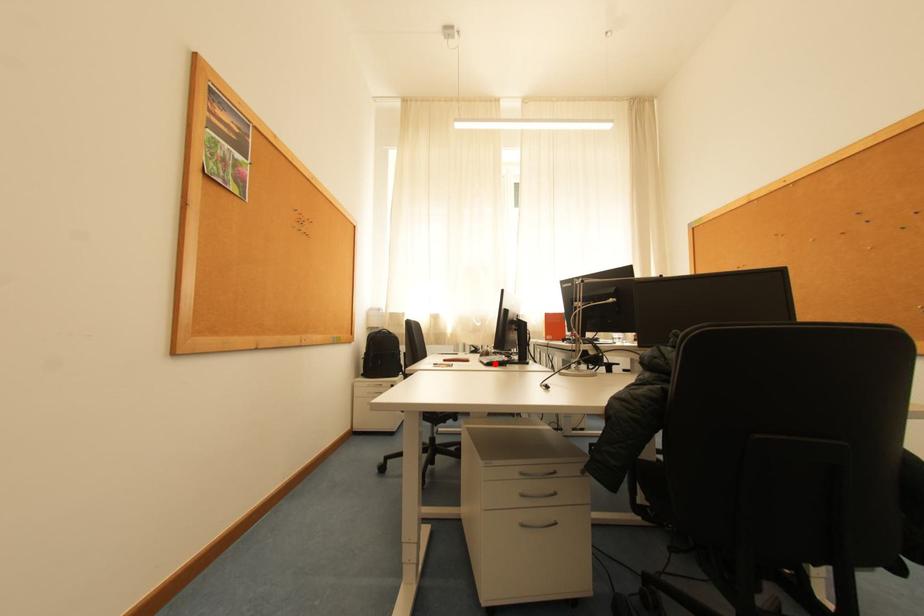
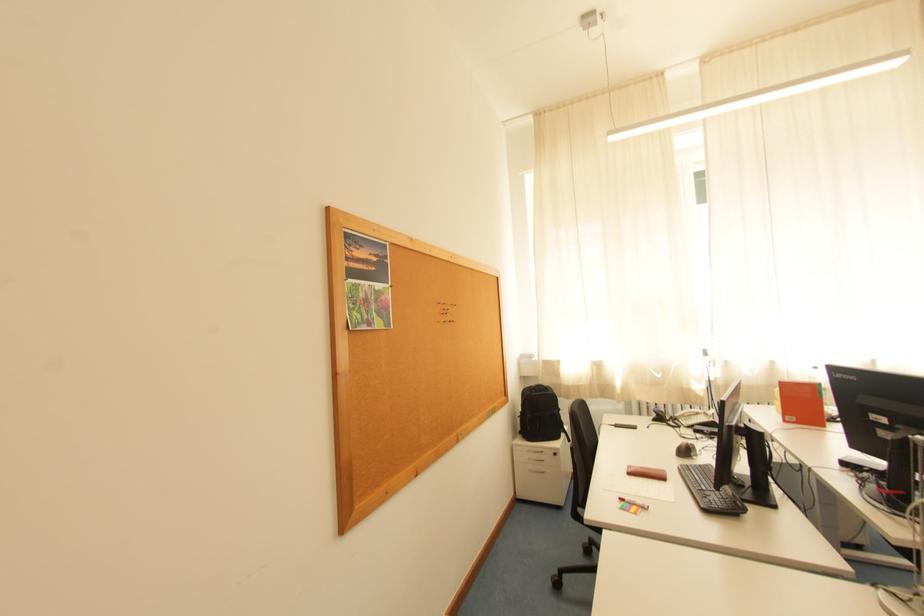
Where in the second image is the point corresponding to the highlighted location from the first image?

(711, 508)